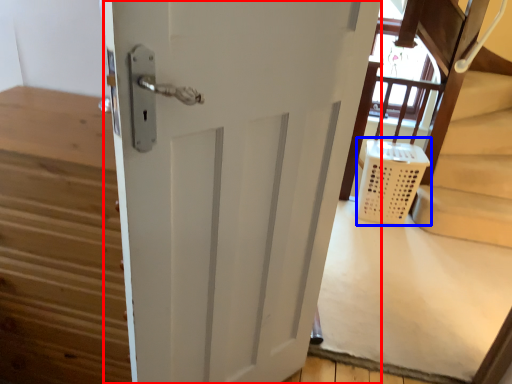
Question: Which point is further to the camera, door (highlighted by a red box) or laundry basket (highlighted by a blue box)?

Choices:
 (A) door
 (B) laundry basket

Answer: (B)